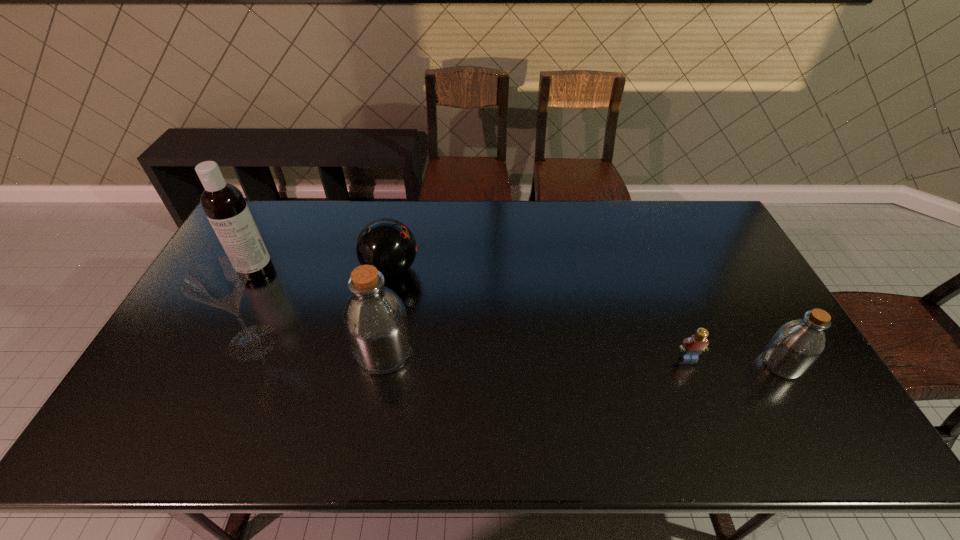
Image resolution: width=960 pixels, height=540 pixels. What are the coordinates of `vacant space at the near edge of the desktop` in the screenshot? It's located at (321, 384).

Find the location of `vacant space at the left edge of the desktop`. vacant space at the left edge of the desktop is located at coordinates pyautogui.click(x=208, y=319).

In order to click on vacant space at the right edge in this screenshot , I will do `click(738, 283)`.

In order to click on free space between the bowling ball and the tallest object in this screenshot , I will do `click(324, 270)`.

Locate an element on the screen. This screenshot has height=540, width=960. blank region between the bowling ball and the shorter bottle is located at coordinates (587, 317).

What are the coordinates of `free space between the tallest object and the shortest object` in the screenshot? It's located at (472, 313).

The height and width of the screenshot is (540, 960). Identify the location of empty location between the shorter bottle and the bowling ball. (587, 317).

This screenshot has height=540, width=960. I want to click on vacant space in between the bowling ball and the fourth shortest object, so click(322, 306).

The height and width of the screenshot is (540, 960). In order to click on empty location between the rightmost object and the bowling ball in this screenshot , I will do `click(587, 317)`.

Where is `blank region between the right bottle and the taller bottle`? The height and width of the screenshot is (540, 960). blank region between the right bottle and the taller bottle is located at coordinates (583, 358).